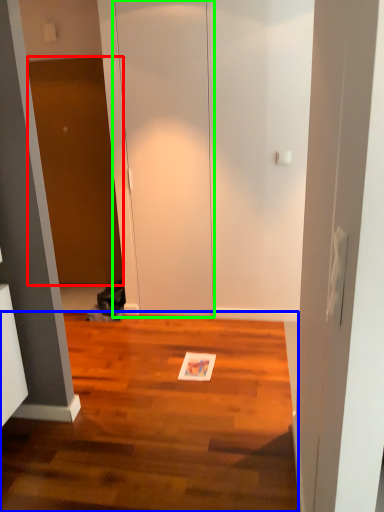
Question: Which is nearer to the door (highlighted by a red box)? hardwood (highlighted by a blue box) or glass door (highlighted by a green box).

Choices:
 (A) hardwood
 (B) glass door

Answer: (B)